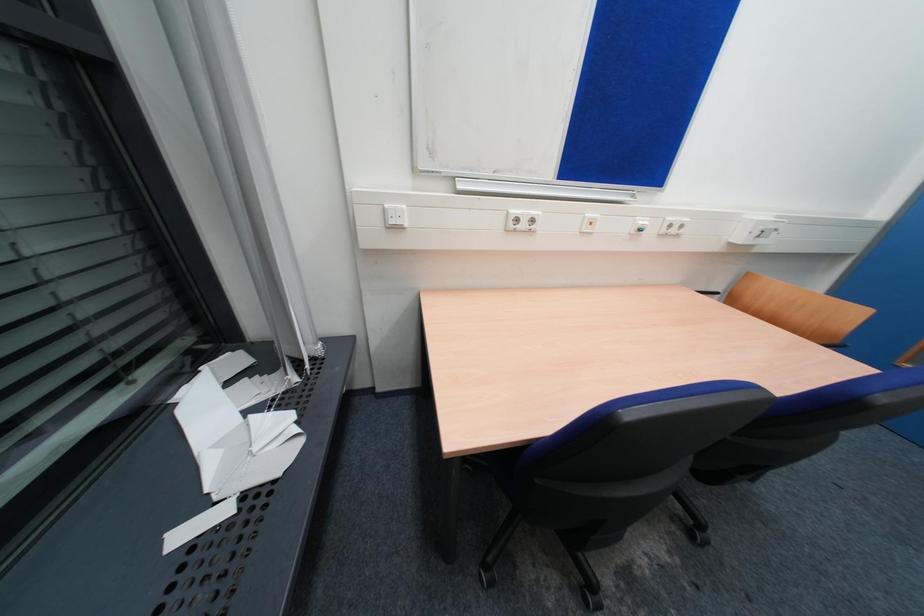
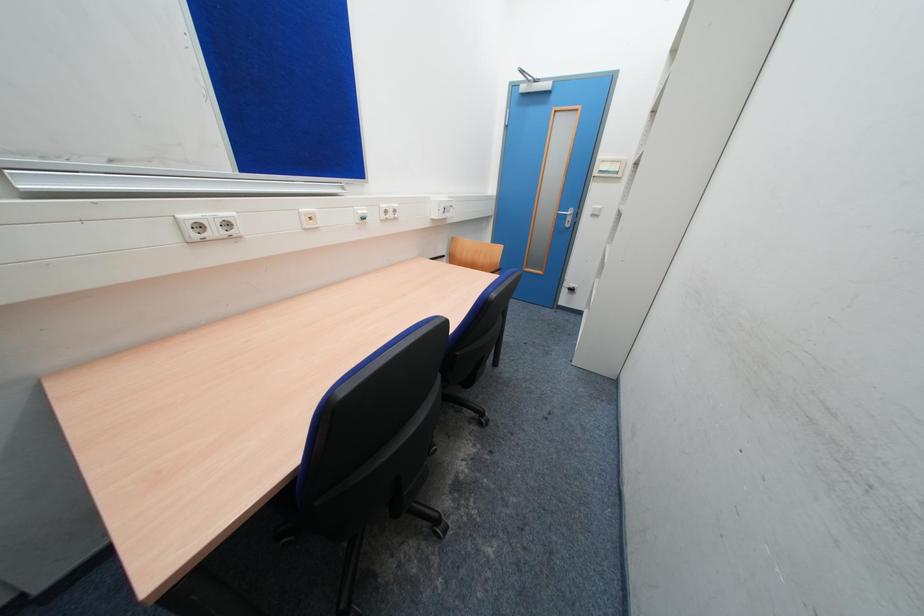
Question: Based on the continuous images, in which direction is the camera rotating? Reply with the corresponding letter.

Choices:
 (A) Left
 (B) Right
 (C) Up
 (D) Down

Answer: (B)